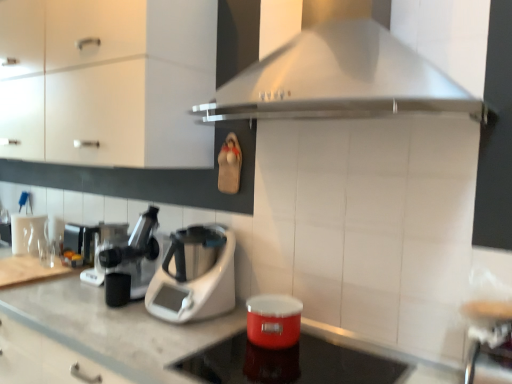
Where is `free space to the left of white plastic food processor at center`? The image size is (512, 384). free space to the left of white plastic food processor at center is located at coordinates (108, 313).